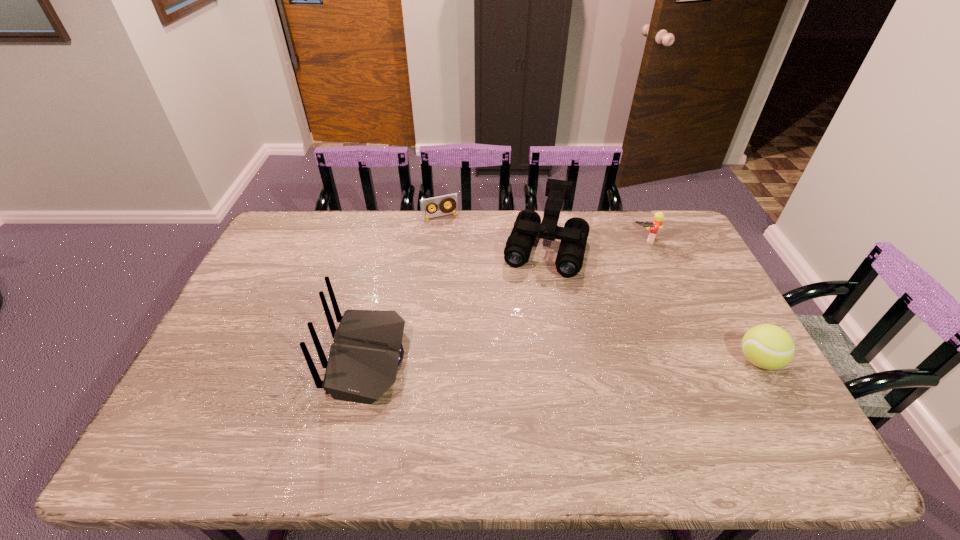
Locate an element on the screen. vacant space located 0.220m on the front lenses of the third object from left to right is located at coordinates (523, 330).

Locate an element on the screen. The width and height of the screenshot is (960, 540). free space located on the front lenses of the third object from left to right is located at coordinates click(519, 346).

Locate an element on the screen. Image resolution: width=960 pixels, height=540 pixels. vacant space situated 0.260m in front of the second object from right to left with the accessory visible is located at coordinates (622, 291).

Locate an element on the screen. The image size is (960, 540). free space located in front of the second object from right to left with the accessory visible is located at coordinates (624, 286).

At what (x,y) coordinates should I click in order to perform the action: click on free space located in front of the second object from right to left with the accessory visible. Please return your answer as a coordinate pair (x, y). This screenshot has height=540, width=960. Looking at the image, I should click on (622, 292).

At what (x,y) coordinates should I click in order to perform the action: click on vacant space located at the front of the videotape with visible reels. Please return your answer as a coordinate pair (x, y). This screenshot has height=540, width=960. Looking at the image, I should click on (472, 274).

Find the location of a particular element. free location located at the front of the videotape with visible reels is located at coordinates (471, 272).

You are a GUI agent. You are given a task and a screenshot of the screen. Output one action in this format:
    pyautogui.click(x=<x>, y=<y>)
    Task: Click on the vacant space positioned at the front of the videotape with visible reels
    
    Given the screenshot: What is the action you would take?
    pyautogui.click(x=454, y=239)

Where is `binoculars that is at the far edge`? This screenshot has height=540, width=960. binoculars that is at the far edge is located at coordinates (528, 225).

The image size is (960, 540). What are the coordinates of `Lego positioned at the far edge` in the screenshot? It's located at (658, 217).